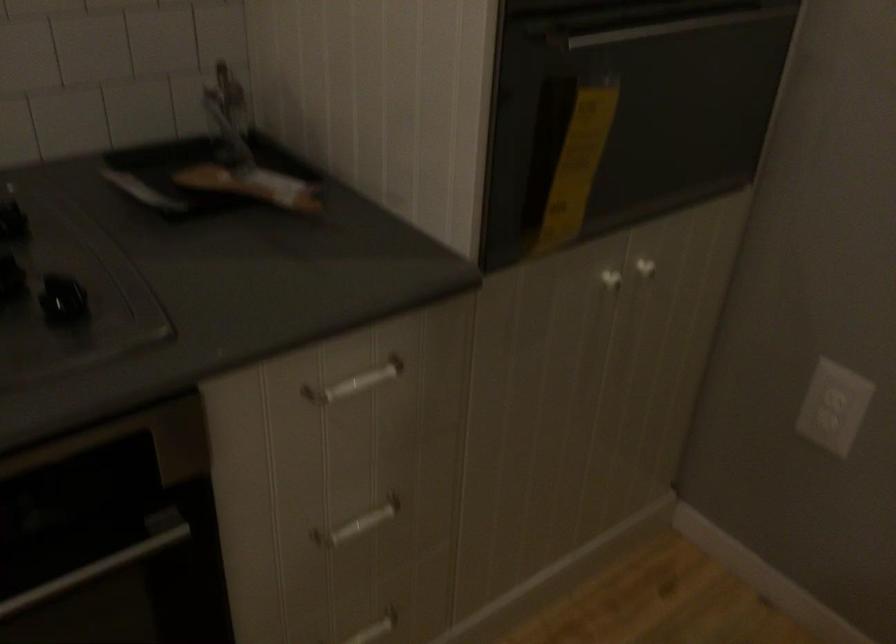
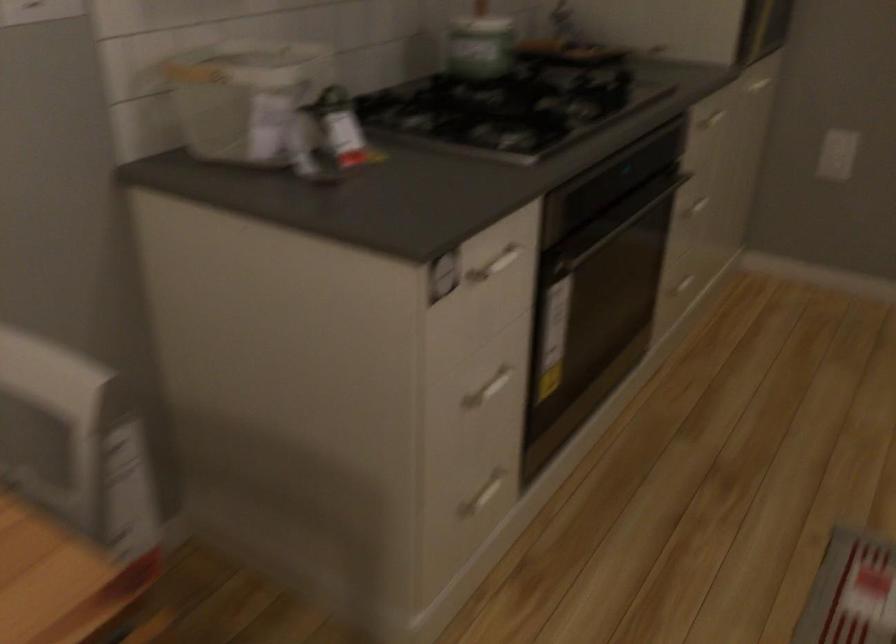
In the second image, find the point that corresponds to point 371,382 in the first image.

(713, 118)